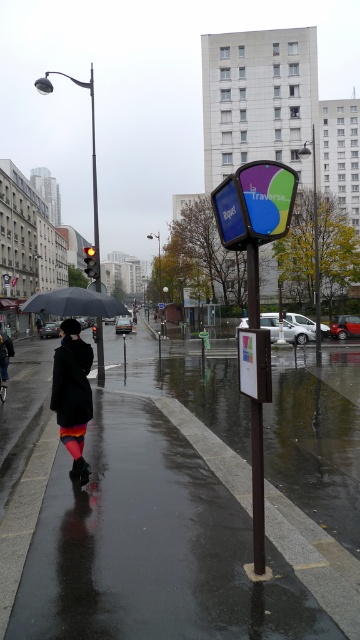
Is point (78, 369) in front of point (84, 314)?

That is True.

Does rainbow knit skirt at lower left have a lesser width compared to black matte umbrella at left?

Yes.

Who is more forward, (64, 332) or (95, 305)?

Point (64, 332) is in front.

The width and height of the screenshot is (360, 640). What are the coordinates of `rainbow knit skirt at lower left` in the screenshot? It's located at (73, 394).

Who is taller, shiny asphalt pavement at center or rainbow knit skirt at lower left?

rainbow knit skirt at lower left

The height and width of the screenshot is (640, 360). I want to click on shiny asphalt pavement at center, so click(199, 506).

Identify the location of shiny asphalt pavement at center. The width and height of the screenshot is (360, 640). (199, 506).

Between shiny asphalt pavement at center and black matte umbrella at left, which one has less height?

Standing shorter between the two is shiny asphalt pavement at center.

Which is behind, point (345, 576) or point (60, 314)?

The point (60, 314) is behind.

Which is in front, point (234, 358) or point (105, 298)?

Point (105, 298) is more forward.

This screenshot has width=360, height=640. I want to click on shiny asphalt pavement at center, so click(199, 506).